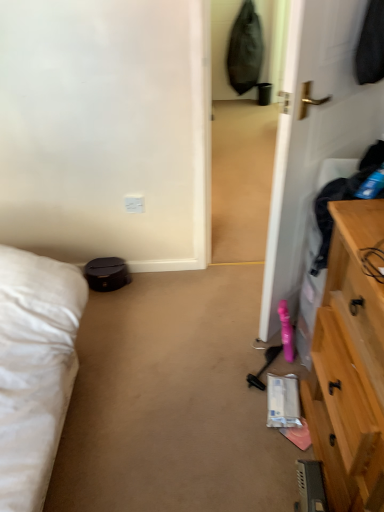
Question: In the image, is white plastic electric outlet at center positioned in front of or behind white glossy door at right?

Choices:
 (A) front
 (B) behind

Answer: (B)

Question: Considering the positions of white plastic electric outlet at center and white glossy door at right in the image, is white plastic electric outlet at center wider or thinner than white glossy door at right?

Choices:
 (A) wide
 (B) thin

Answer: (B)

Question: From a real-world perspective, is white plastic electric outlet at center positioned above or below white glossy door at right?

Choices:
 (A) above
 (B) below

Answer: (B)

Question: Relative to white plastic electric outlet at center, is white glossy door at right in front or behind?

Choices:
 (A) behind
 (B) front

Answer: (B)

Question: Looking at their shapes, would you say white glossy door at right is wider or thinner than white plastic electric outlet at center?

Choices:
 (A) thin
 (B) wide

Answer: (B)

Question: Is white glossy door at right taller or shorter than white plastic electric outlet at center?

Choices:
 (A) short
 (B) tall

Answer: (B)

Question: Would you say white glossy door at right is inside or outside white plastic electric outlet at center?

Choices:
 (A) inside
 (B) outside

Answer: (B)